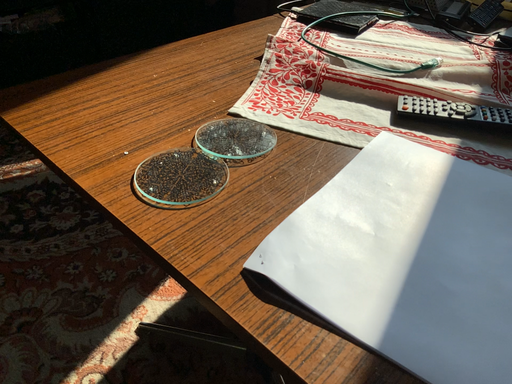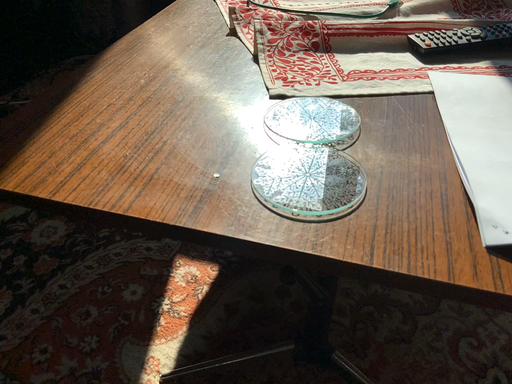
Question: Which way did the camera rotate in the video?

Choices:
 (A) rotated right
 (B) rotated left

Answer: (A)